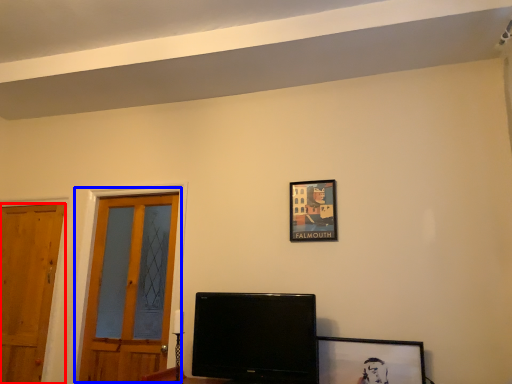
Question: Which of the following is the closest to the observer, door (highlighted by a red box) or door (highlighted by a blue box)?

Choices:
 (A) door
 (B) door

Answer: (B)